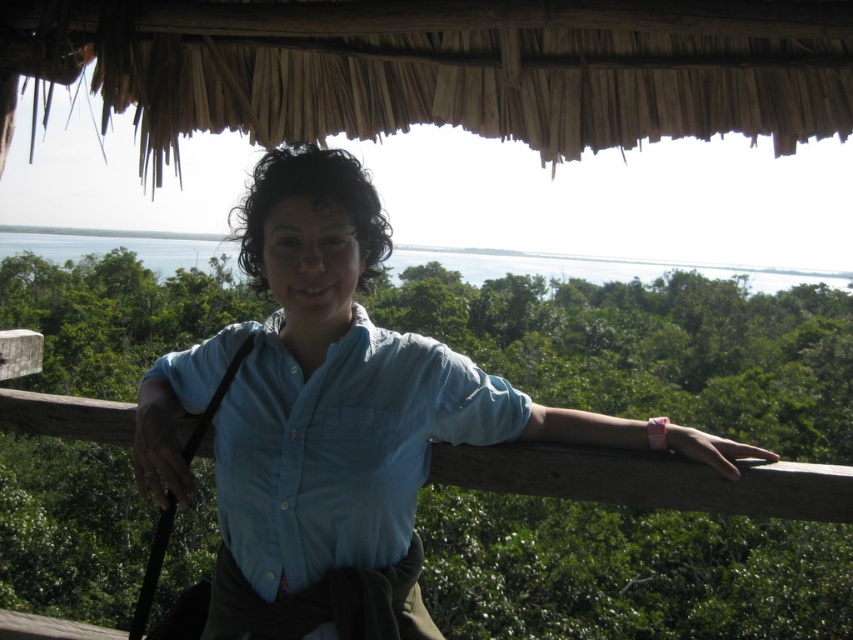
Question: Is the position of blue cotton shirt at center less distant than that of light blue cotton shirt at center?

Choices:
 (A) no
 (B) yes

Answer: (B)

Question: Is blue cotton shirt at center smaller than light blue cotton shirt at center?

Choices:
 (A) no
 (B) yes

Answer: (A)

Question: Which point is closer to the camera taking this photo?

Choices:
 (A) (315, 456)
 (B) (444, 374)

Answer: (A)

Question: Does blue cotton shirt at center appear on the right side of light blue cotton shirt at center?

Choices:
 (A) yes
 (B) no

Answer: (A)